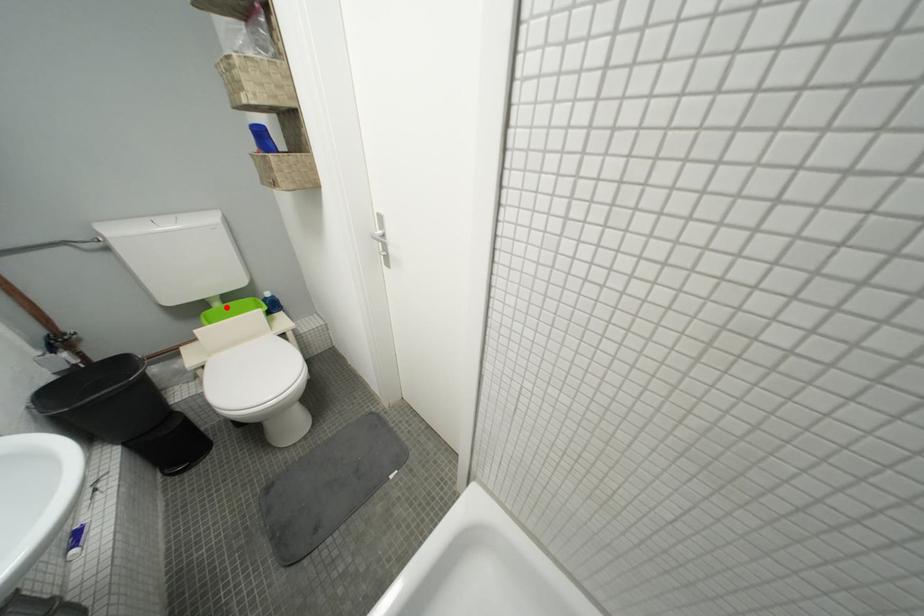
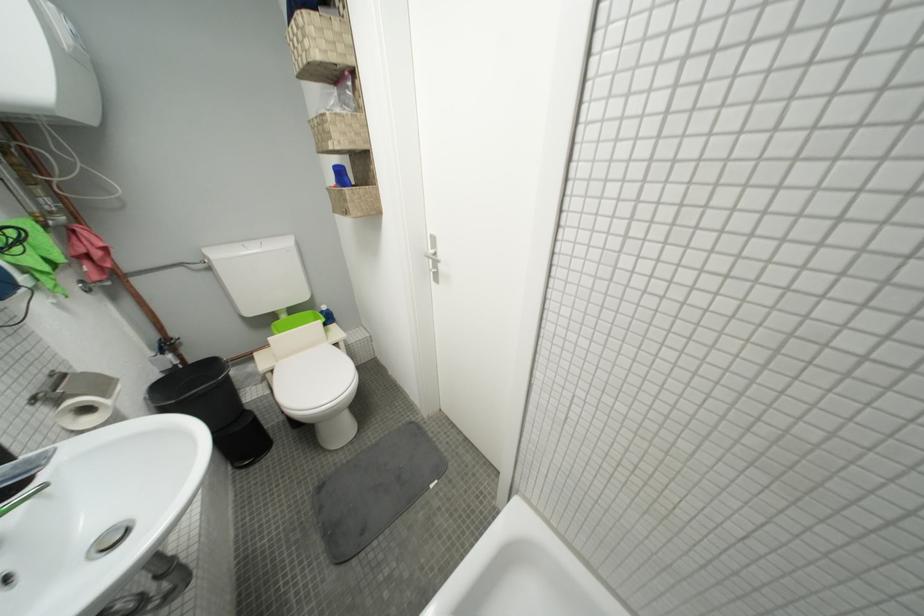
The point at the highlighted location is marked in the first image. Where is the corresponding point in the second image?

(293, 318)